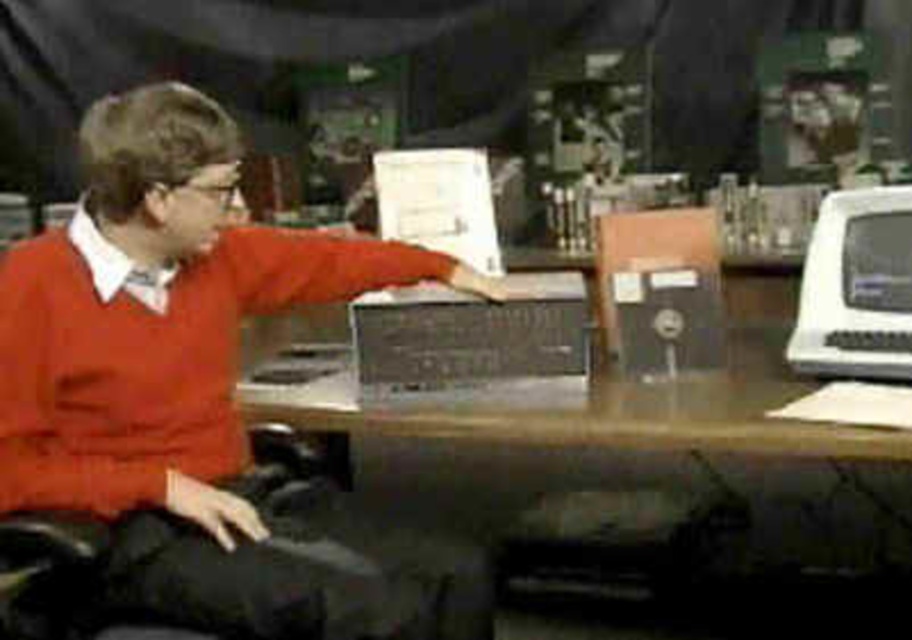
Is point (306, 422) positioned after point (855, 275)?

No.

What do you see at coordinates (658, 458) in the screenshot?
I see `wooden at center` at bounding box center [658, 458].

The height and width of the screenshot is (640, 912). Find the location of `wooden at center`. wooden at center is located at coordinates (658, 458).

Which of these two, matte orange sweater at center or shiny black monitor at right, stands shorter?

With less height is shiny black monitor at right.

Is matte orange sweater at center thinner than shiny black monitor at right?

No.

At what (x,y) coordinates should I click in order to perform the action: click on matte orange sweater at center. Please return your answer as a coordinate pair (x, y). Looking at the image, I should click on (194, 385).

Measure the distance between metallic silver laptop at center and camera.

metallic silver laptop at center and camera are 2.59 meters apart from each other.

Is metallic silver laptop at center to the right of shiny black monitor at right from the viewer's perspective?

Incorrect, metallic silver laptop at center is not on the right side of shiny black monitor at right.

Where is `metallic silver laptop at center`? The width and height of the screenshot is (912, 640). metallic silver laptop at center is located at coordinates (472, 348).